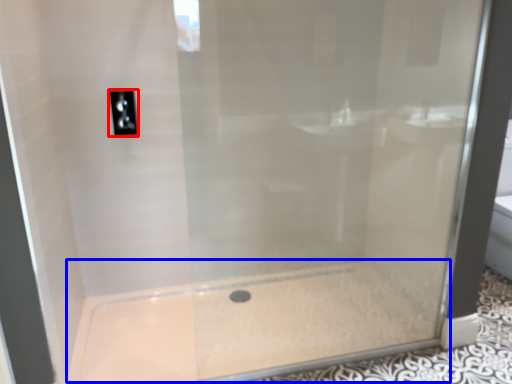
Question: Which point is further to the camera, light switch (highlighted by a red box) or bath (highlighted by a blue box)?

Choices:
 (A) light switch
 (B) bath

Answer: (A)